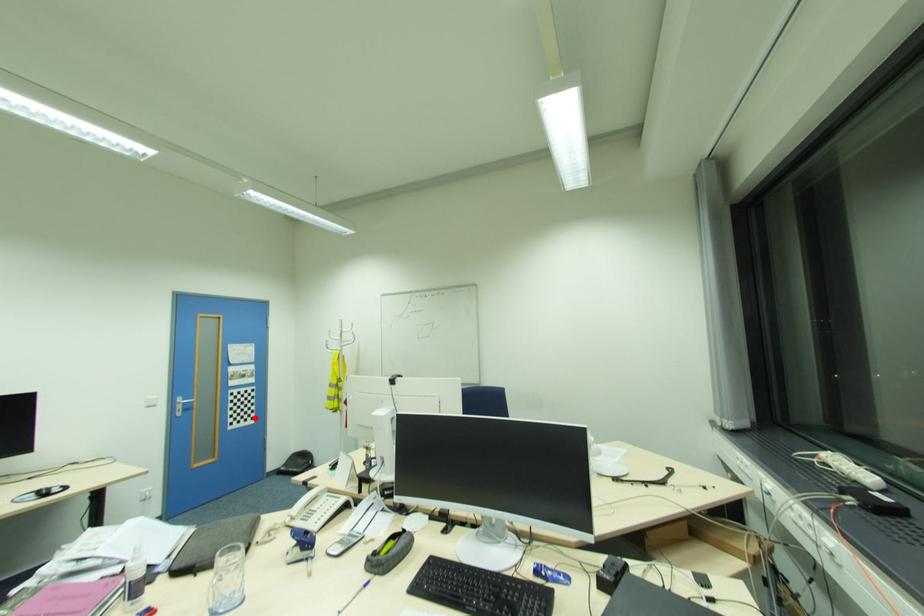
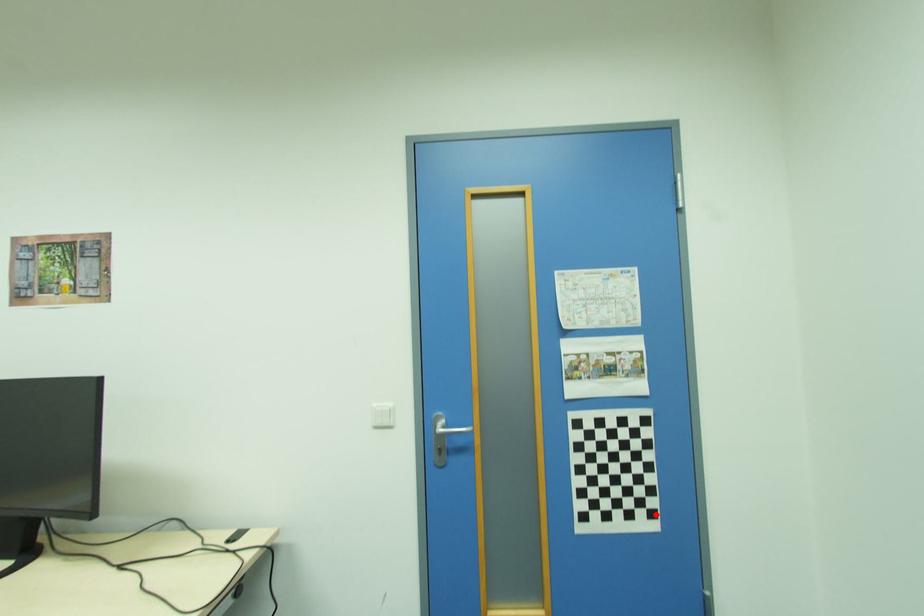
I am providing you with two images of the same scene from different viewpoints. A red point is marked on the first image and another point is marked on the second image. Does the point marked in image1 correspond to the same location as the one in image2?

Yes